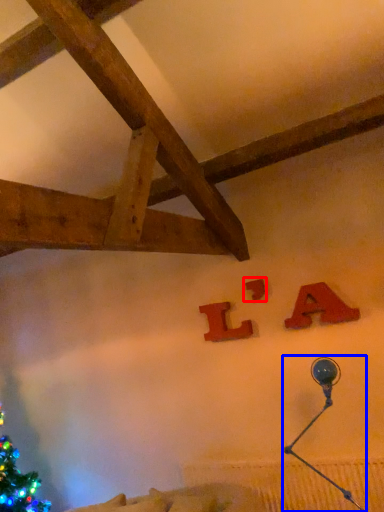
Question: Among these objects, which one is nearest to the camera, alphabet (highlighted by a red box) or lamp (highlighted by a blue box)?

Choices:
 (A) alphabet
 (B) lamp

Answer: (B)